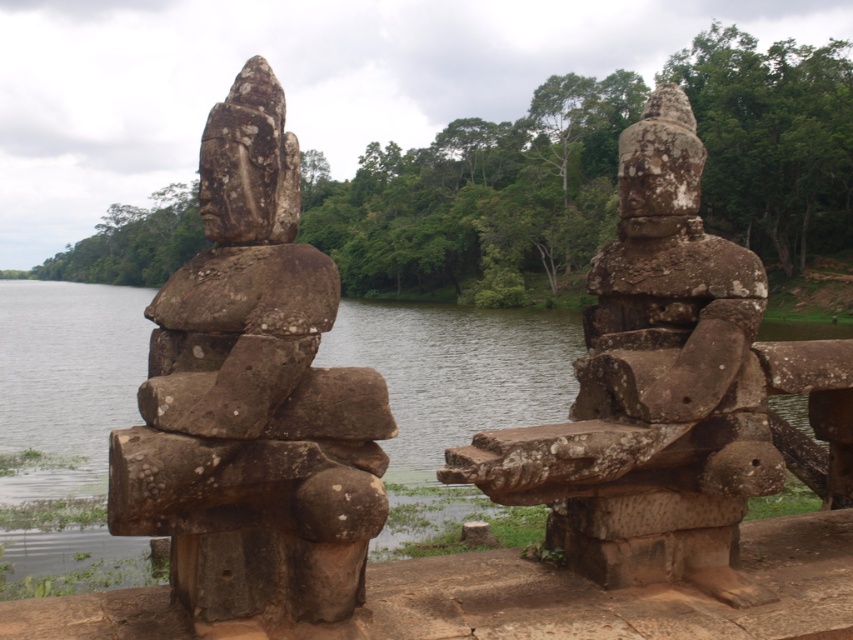
You are a visitor standing at the edge of the water looking towards the stone platform. You see the rusty stone statue at left and the rusty stone statue at center. Which statue is positioned higher relative to the other?

The rusty stone statue at left is above the rusty stone statue at center, so it is positioned higher.

You are a tourist standing on the stone platform where the rusty stone statue at left and the green mossy water at center are located. You want to take a photo that includes both objects in the frame. Which object should you position closer to the camera to ensure both are visible without cropping?

You should position the rusty stone statue at left closer to the camera because it is shorter than the green mossy water at center, allowing both to fit within the frame without cropping.

You are standing in front of the stone platform with two ancient stone statues. You want to place a 1.5 meter long wooden bench between the rusty stone statue at left and the viewer. Is there enough space to place the bench without it overlapping with the statue?

The distance between the rusty stone statue at left and the viewer is 4.13 meters. Since the bench is 1.5 meters long, there is sufficient space to place it without overlapping as 4.13 meters is greater than 1.5 meters.